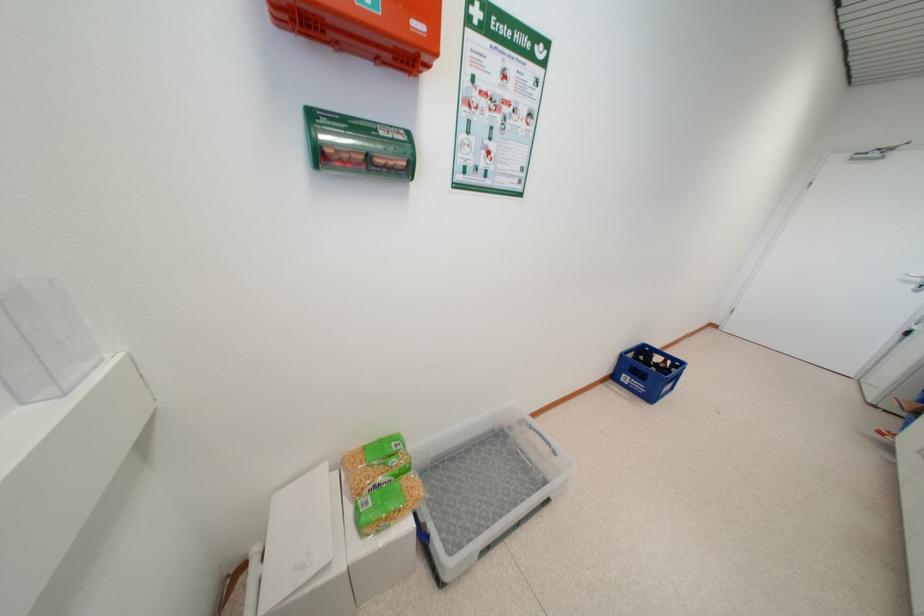
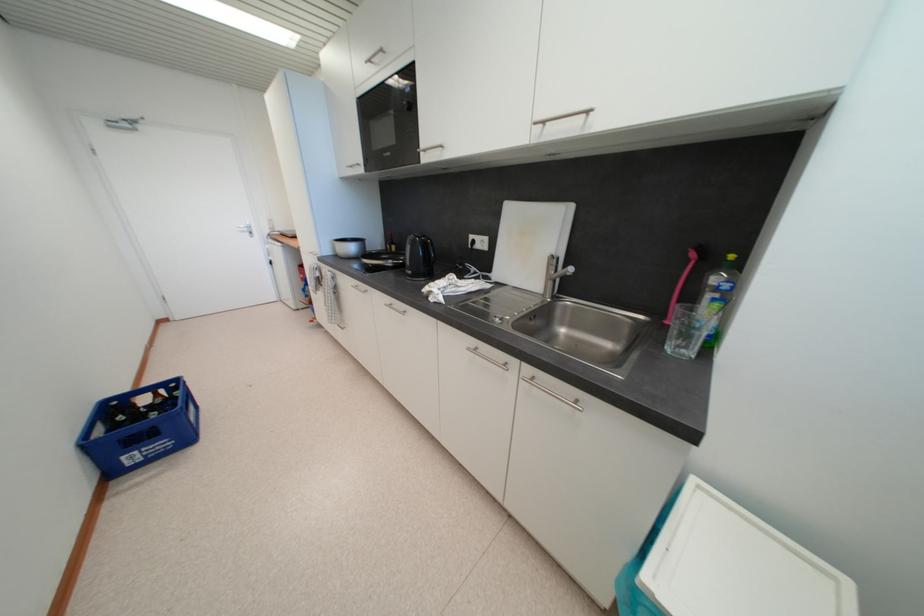
Locate, in the second image, the point that corresponds to point (630, 381) in the first image.

(138, 460)